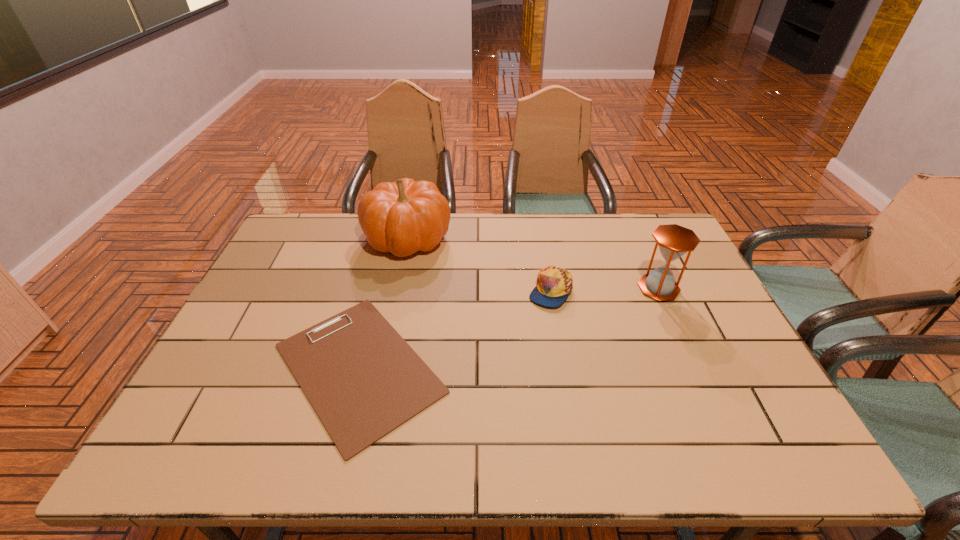
At what (x,y) coordinates should I click in order to perform the action: click on the farthest object. Please return your answer as a coordinate pair (x, y). The height and width of the screenshot is (540, 960). Looking at the image, I should click on (406, 216).

At what (x,y) coordinates should I click in order to perform the action: click on hourglass. Please return your answer as a coordinate pair (x, y). Looking at the image, I should click on (674, 241).

The image size is (960, 540). In order to click on the rightmost object in this screenshot , I will do `click(674, 241)`.

Locate an element on the screen. the third tallest object is located at coordinates (554, 284).

Identify the location of cap. Image resolution: width=960 pixels, height=540 pixels. (554, 284).

This screenshot has width=960, height=540. In order to click on clipboard in this screenshot , I will do (363, 380).

Locate an element on the screen. The height and width of the screenshot is (540, 960). free region located on the front of the farthest object is located at coordinates (396, 290).

This screenshot has height=540, width=960. Identify the location of vacant region located 0.360m on the left of the rightmost object. (518, 288).

This screenshot has width=960, height=540. In order to click on vacant area situated on the bill of the cap in this screenshot , I will do `click(565, 377)`.

I want to click on vacant space located 0.260m on the back of the clipboard, so click(390, 247).